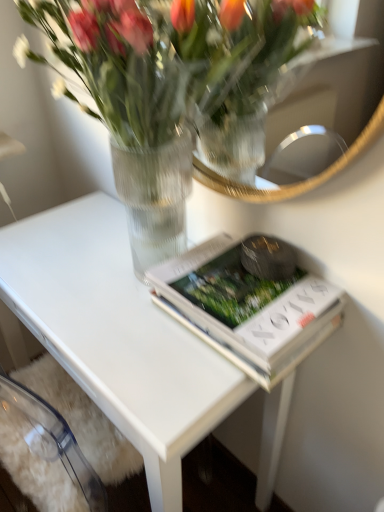
Locate an element on the screen. The height and width of the screenshot is (512, 384). vacant region above white matte book at center (from a real-world perspective) is located at coordinates (247, 277).